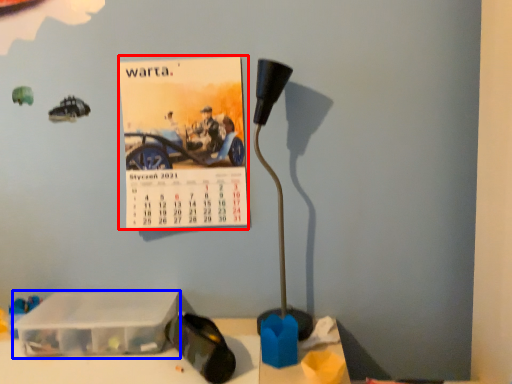
Question: Which object is closer to the camera taking this photo, postcard (highlighted by a red box) or box (highlighted by a blue box)?

Choices:
 (A) postcard
 (B) box

Answer: (B)